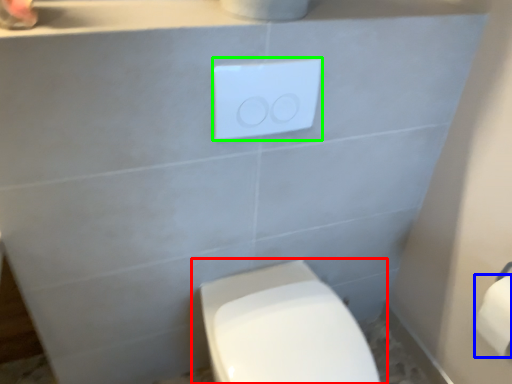
Question: Based on their relative distances, which object is nearer to toilet (highlighted by a red box)? Choose from toilet paper (highlighted by a blue box) and light switch (highlighted by a green box).

Choices:
 (A) toilet paper
 (B) light switch

Answer: (A)